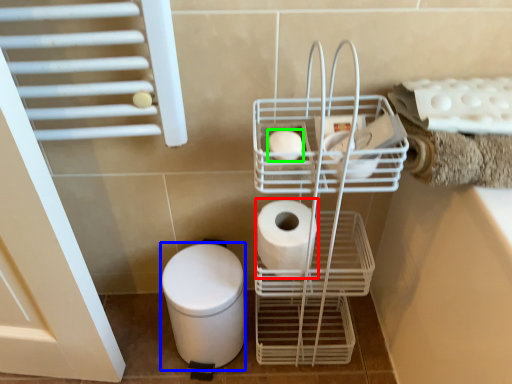
Question: Estimate the real-world distances between objects in this image. Which object is closer to toilet paper (highlighted by a red box), bidet (highlighted by a blue box) or toilet paper (highlighted by a green box)?

Choices:
 (A) bidet
 (B) toilet paper

Answer: (B)